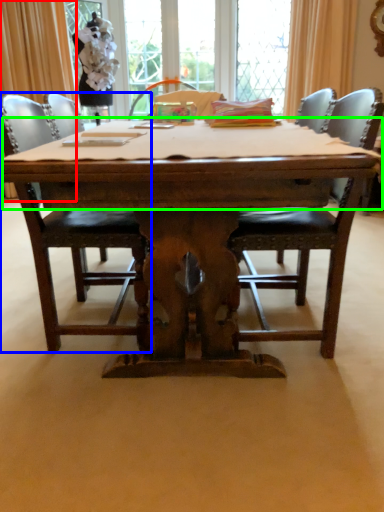
Question: Which is nearer to the curtain (highlighted by a red box)? chair (highlighted by a blue box) or table top (highlighted by a green box).

Choices:
 (A) chair
 (B) table top

Answer: (A)